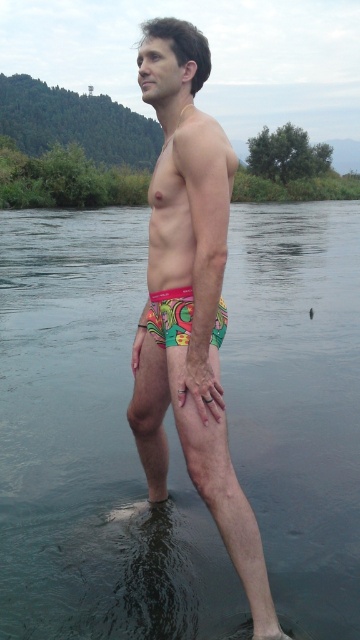
Between point (75, 538) and point (245, 502), which one is positioned in front?

Positioned in front is point (245, 502).

Which is more to the right, clear water at lower center or multicolored fabric shorts at center?

multicolored fabric shorts at center

Measure the distance between point (244, 419) and camera.

A distance of 14.78 feet exists between point (244, 419) and camera.

At what (x,y) coordinates should I click in order to perform the action: click on clear water at lower center. Please return your answer as a coordinate pair (x, y). The height and width of the screenshot is (640, 360). Looking at the image, I should click on (92, 451).

Consider the image. Is clear water at lower center shorter than vibrant printed fabric shorts at center?

No, clear water at lower center is not shorter than vibrant printed fabric shorts at center.

Which is more to the left, clear water at lower center or vibrant printed fabric shorts at center?

From the viewer's perspective, clear water at lower center appears more on the left side.

The height and width of the screenshot is (640, 360). Identify the location of clear water at lower center. (92, 451).

Who is more distant from viewer, (214, 164) or (222, 301)?

The point (222, 301) is more distant.

Does multicolored fabric shorts at center appear on the left side of vibrant printed fabric shorts at center?

Incorrect, multicolored fabric shorts at center is not on the left side of vibrant printed fabric shorts at center.

The width and height of the screenshot is (360, 640). I want to click on multicolored fabric shorts at center, so click(x=191, y=301).